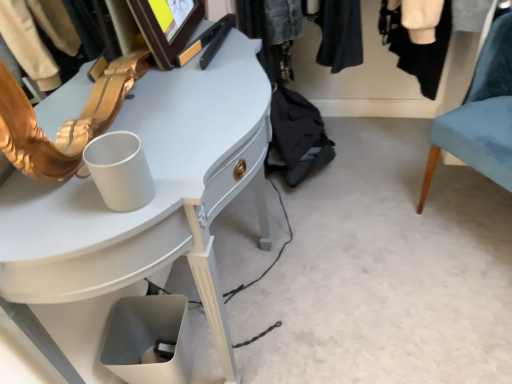
Question: From the image's perspective, is velvet teal chair at right on white glossy desk at upper left?

Choices:
 (A) no
 (B) yes

Answer: (B)

Question: Can you confirm if velvet teal chair at right is bigger than white glossy desk at upper left?

Choices:
 (A) yes
 (B) no

Answer: (B)

Question: Considering the relative sizes of velvet teal chair at right and white glossy desk at upper left in the image provided, is velvet teal chair at right taller than white glossy desk at upper left?

Choices:
 (A) yes
 (B) no

Answer: (B)

Question: Is velvet teal chair at right at the left side of white glossy desk at upper left?

Choices:
 (A) yes
 (B) no

Answer: (B)

Question: Considering the relative sizes of velvet teal chair at right and white glossy desk at upper left in the image provided, is velvet teal chair at right wider than white glossy desk at upper left?

Choices:
 (A) no
 (B) yes

Answer: (B)

Question: Does point (166, 137) appear closer or farther from the camera than point (373, 6)?

Choices:
 (A) closer
 (B) farther

Answer: (A)

Question: Is white glossy desk at upper left spatially inside denim jacket at upper center, or outside of it?

Choices:
 (A) outside
 (B) inside

Answer: (A)

Question: Considering the positions of white glossy desk at upper left and denim jacket at upper center in the image, is white glossy desk at upper left taller or shorter than denim jacket at upper center?

Choices:
 (A) short
 (B) tall

Answer: (B)

Question: Looking at the image, does white glossy desk at upper left seem bigger or smaller compared to denim jacket at upper center?

Choices:
 (A) small
 (B) big

Answer: (B)

Question: From the image's perspective, is denim jacket at upper center above or below velvet teal chair at right?

Choices:
 (A) above
 (B) below

Answer: (A)

Question: From a real-world perspective, relative to velvet teal chair at right, is denim jacket at upper center vertically above or below?

Choices:
 (A) below
 (B) above

Answer: (B)

Question: Is point (379, 64) positioned closer to the camera than point (488, 97)?

Choices:
 (A) farther
 (B) closer

Answer: (A)

Question: Would you say denim jacket at upper center is inside or outside velvet teal chair at right?

Choices:
 (A) outside
 (B) inside

Answer: (A)

Question: Which is correct: denim jacket at upper center is inside white glossy desk at upper left, or outside of it?

Choices:
 (A) inside
 (B) outside

Answer: (B)

Question: Considering the positions of denim jacket at upper center and white glossy desk at upper left in the image, is denim jacket at upper center bigger or smaller than white glossy desk at upper left?

Choices:
 (A) small
 (B) big

Answer: (A)